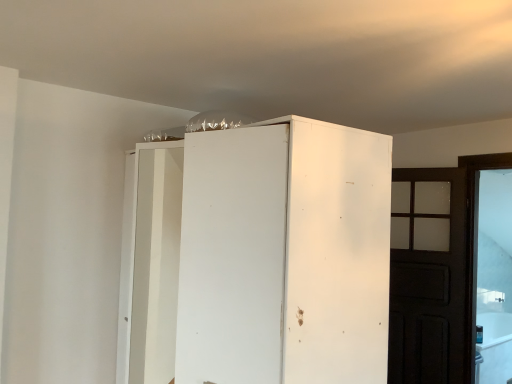
In order to face dark wood door at right, should I rotate leftwards or rightwards?

It's best to rotate right around 22.187 degrees.

You are a GUI agent. You are given a task and a screenshot of the screen. Output one action in this format:
    pyautogui.click(x=<x>, y=<y>)
    Task: Click on the dark wood door at right
    This screenshot has height=384, width=512.
    Given the screenshot: What is the action you would take?
    pyautogui.click(x=428, y=288)

Image resolution: width=512 pixels, height=384 pixels. What do you see at coordinates (428, 288) in the screenshot? I see `dark wood door at right` at bounding box center [428, 288].

At what (x,y) coordinates should I click in order to perform the action: click on white matte cabinet at center. Please return your answer as a coordinate pair (x, y). Looking at the image, I should click on (260, 256).

Describe the element at coordinates (260, 256) in the screenshot. The width and height of the screenshot is (512, 384). I see `white matte cabinet at center` at that location.

Find the location of `dark wood door at right`. dark wood door at right is located at coordinates (428, 288).

Which object is positioned more to the right, white matte cabinet at center or dark wood door at right?

Positioned to the right is dark wood door at right.

Is white matte cabinet at center further to the viewer compared to dark wood door at right?

No.

Between point (167, 358) and point (455, 188), which one is positioned behind?

Positioned behind is point (167, 358).

From the image's perspective, which is below, white matte cabinet at center or dark wood door at right?

dark wood door at right is shown below in the image.

From a real-world perspective, who is located higher, white matte cabinet at center or dark wood door at right?

white matte cabinet at center.

Considering the relative sizes of white matte cabinet at center and dark wood door at right in the image provided, is white matte cabinet at center wider than dark wood door at right?

Yes, white matte cabinet at center is wider than dark wood door at right.

Considering the sizes of white matte cabinet at center and dark wood door at right in the image, is white matte cabinet at center taller or shorter than dark wood door at right?

Considering their sizes, white matte cabinet at center has less height than dark wood door at right.

Considering the relative sizes of white matte cabinet at center and dark wood door at right in the image provided, is white matte cabinet at center bigger than dark wood door at right?

Indeed, white matte cabinet at center has a larger size compared to dark wood door at right.

Is dark wood door at right surrounded by white matte cabinet at center?

Actually, dark wood door at right is outside white matte cabinet at center.

Is white matte cabinet at center directly adjacent to dark wood door at right?

No, white matte cabinet at center is not next to dark wood door at right.

Is white matte cabinet at center aimed at dark wood door at right?

No, white matte cabinet at center is not facing towards dark wood door at right.

How distant is white matte cabinet at center from dark wood door at right?

5.69 feet.

The image size is (512, 384). What are the coordinates of `cupboard in front of the dark wood door at right` in the screenshot? It's located at (260, 256).

Would you say dark wood door at right is to the left or to the right of white matte cabinet at center in the picture?

Based on their positions, dark wood door at right is located to the right of white matte cabinet at center.

Considering the relative positions of dark wood door at right and white matte cabinet at center in the image provided, is dark wood door at right in front of white matte cabinet at center?

No, dark wood door at right is behind white matte cabinet at center.

Considering the positions of points (440, 271) and (293, 122), is point (440, 271) closer to camera compared to point (293, 122)?

No, (440, 271) is further to viewer.

From the image's perspective, which is above, dark wood door at right or white matte cabinet at center?

white matte cabinet at center, from the image's perspective.

From a real-world perspective, is dark wood door at right on white matte cabinet at center?

No, from a real-world perspective, dark wood door at right is not on top of white matte cabinet at center.

Is dark wood door at right wider than white matte cabinet at center?

In fact, dark wood door at right might be narrower than white matte cabinet at center.

Looking at this image, does dark wood door at right have a lesser height compared to white matte cabinet at center?

No, dark wood door at right is not shorter than white matte cabinet at center.

In terms of size, does dark wood door at right appear bigger or smaller than white matte cabinet at center?

Clearly, dark wood door at right is smaller in size than white matte cabinet at center.

Is dark wood door at right outside of white matte cabinet at center?

dark wood door at right lies outside white matte cabinet at center's area.

Are dark wood door at right and white matte cabinet at center far apart?

Yes, dark wood door at right and white matte cabinet at center are quite far apart.

Is dark wood door at right facing towards white matte cabinet at center?

No, dark wood door at right is not facing towards white matte cabinet at center.

How different are the orientations of dark wood door at right and white matte cabinet at center in degrees?

dark wood door at right and white matte cabinet at center are facing 32.1 degrees away from each other.

Measure the distance between dark wood door at right and white matte cabinet at center.

A distance of 1.73 meters exists between dark wood door at right and white matte cabinet at center.

You are a GUI agent. You are given a task and a screenshot of the screen. Output one action in this format:
    pyautogui.click(x=<x>, y=<y>)
    Task: Click on the cupboard above the dark wood door at right (from a real-world perspective)
    This screenshot has height=384, width=512.
    Given the screenshot: What is the action you would take?
    pyautogui.click(x=260, y=256)

This screenshot has height=384, width=512. Identify the location of door below the white matte cabinet at center (from the image's perspective). (428, 288).

Image resolution: width=512 pixels, height=384 pixels. In order to click on door beneath the white matte cabinet at center (from a real-world perspective) in this screenshot , I will do `click(428, 288)`.